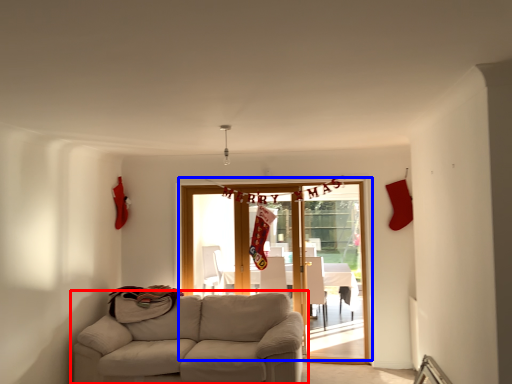
Question: Which point is closer to the camera, studio couch (highlighted by a red box) or door (highlighted by a blue box)?

Choices:
 (A) studio couch
 (B) door

Answer: (A)